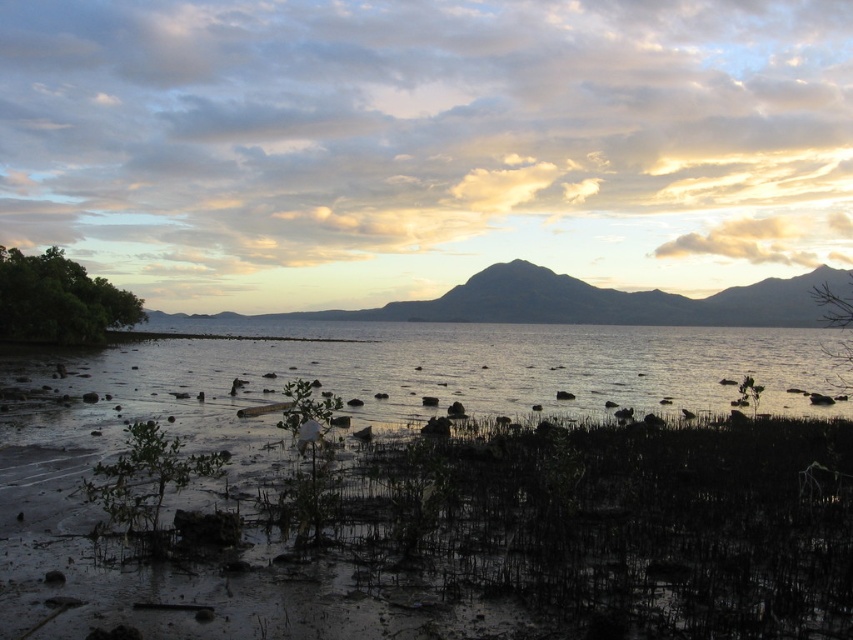
Does point (222, 380) lie in front of point (775, 310)?

Yes, point (222, 380) is closer to viewer.

Who is more distant from viewer, (469, 365) or (241, 317)?

Positioned behind is point (241, 317).

This screenshot has height=640, width=853. In order to click on clear water at center in this screenshot , I will do `click(437, 371)`.